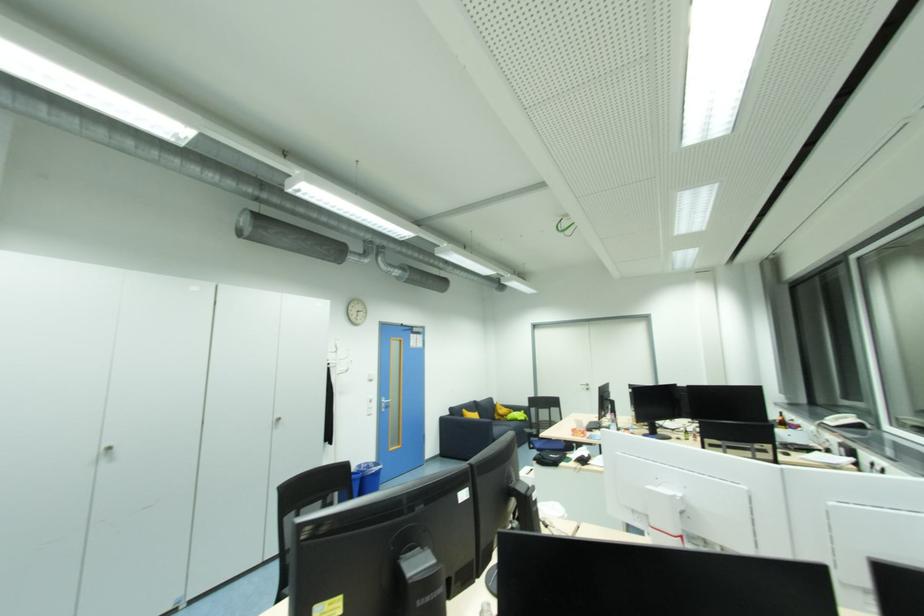
I want to click on blue chair seat, so click(550, 444).